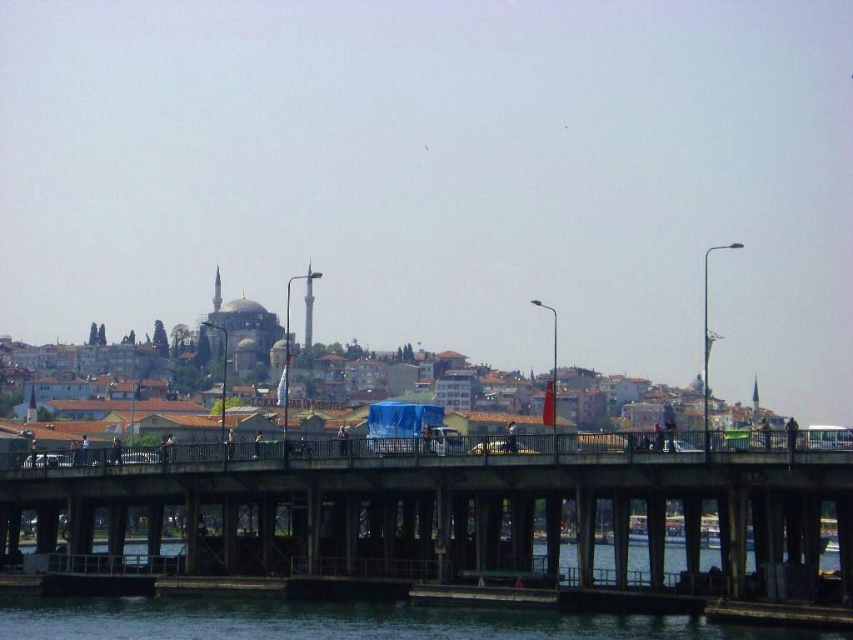
You are a photographer planning to capture the cityscape from the bridge. You notice the concrete bridge at center and the transparent water at lower center. Which object is positioned lower in the image?

The concrete bridge at center is positioned below the transparent water at lower center, so it is lower in the image.

Based on the photo, you are standing on the shore looking at the cityscape. Which object is closer to you, the concrete bridge at center or the transparent water at lower center?

The concrete bridge at center is closer to you than the transparent water at lower center because it is further to the viewer according to the description.

You are a city planner analyzing the image to assess space usage. The concrete bridge at center and transparent water at lower center are both visible. Which of these two features occupies a greater area in the image?

The concrete bridge at center has a larger size compared to transparent water at lower center, so it occupies a greater area in the image.